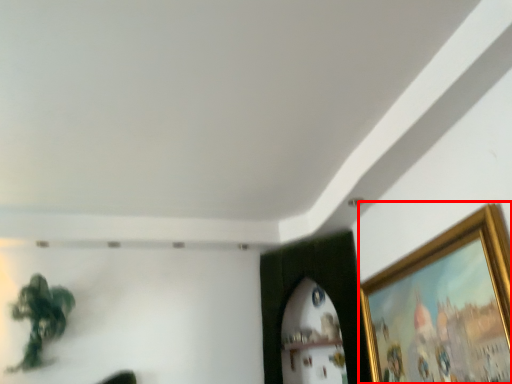
Question: Considering the relative positions of picture frame (annotated by the red box) and plant in the image provided, where is picture frame (annotated by the red box) located with respect to the staircase?

Choices:
 (A) left
 (B) right

Answer: (B)